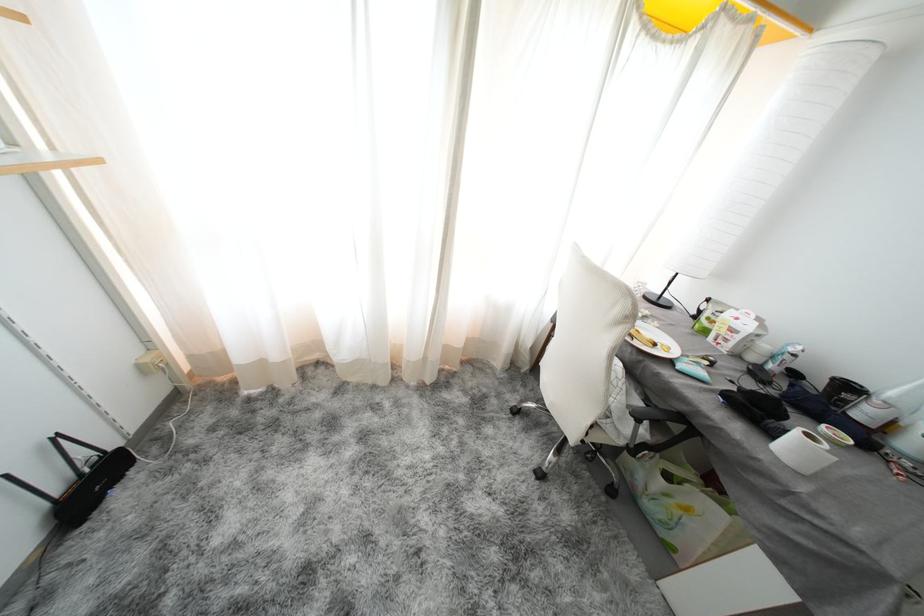
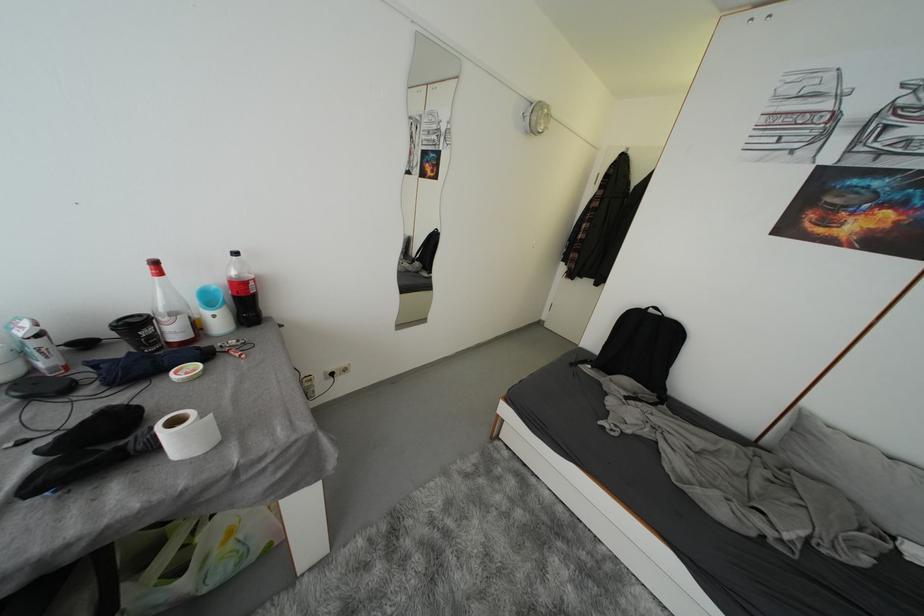
The first image is from the beginning of the video and the second image is from the end. How did the camera likely rotate when shooting the video?

The rotation direction of the camera is right-down.